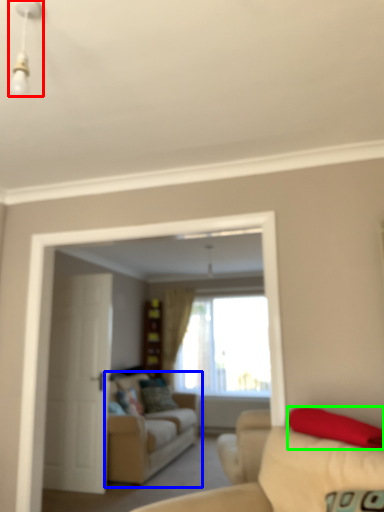
Question: Which is farther away from light fixture (highlighted by a red box)? studio couch (highlighted by a blue box) or pillow (highlighted by a green box)?

Choices:
 (A) studio couch
 (B) pillow

Answer: (A)